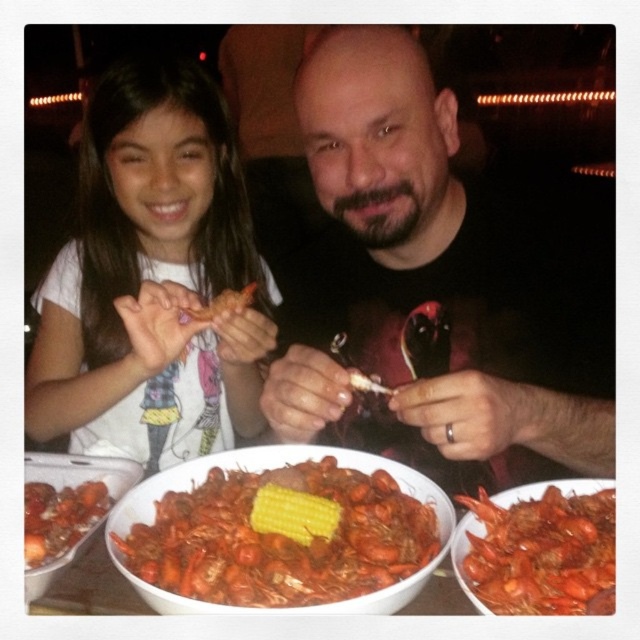
Question: Which of the following is the closest to the observer?

Choices:
 (A) (44, 458)
 (B) (376, 490)

Answer: (B)

Question: Is shiny orange crawfish at center bigger than shiny red crawfish at lower left?

Choices:
 (A) yes
 (B) no

Answer: (A)

Question: Can you confirm if yellow matte corn at center is positioned to the right of orange glossy crawfish at center?

Choices:
 (A) no
 (B) yes

Answer: (B)

Question: Which object appears farthest from the camera in this image?

Choices:
 (A) yellow matte corn at center
 (B) smooth black shirt at center

Answer: (B)

Question: Which is nearer to the shiny red crawfish at lower left?

Choices:
 (A) matte white bowl at lower left
 (B) matte white shirt at left
 (C) shiny red crawfish at center

Answer: (A)

Question: Observing the image, what is the correct spatial positioning of smooth black shirt at center in reference to shiny red crawfish at center?

Choices:
 (A) below
 (B) above

Answer: (B)